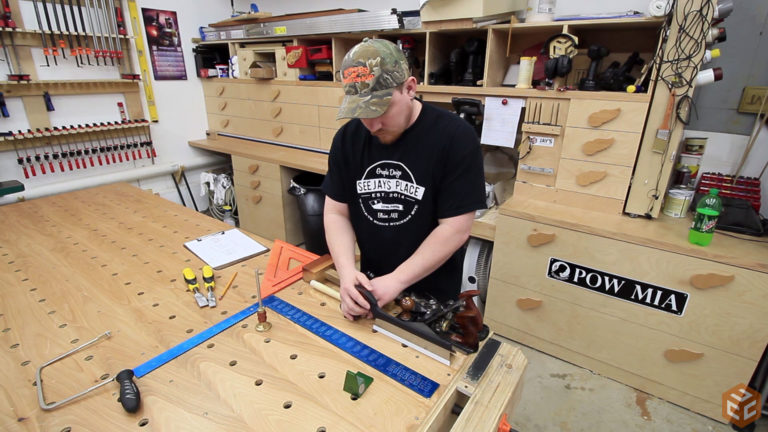
Find the location of `clipboard`. clipboard is located at coordinates (223, 248).